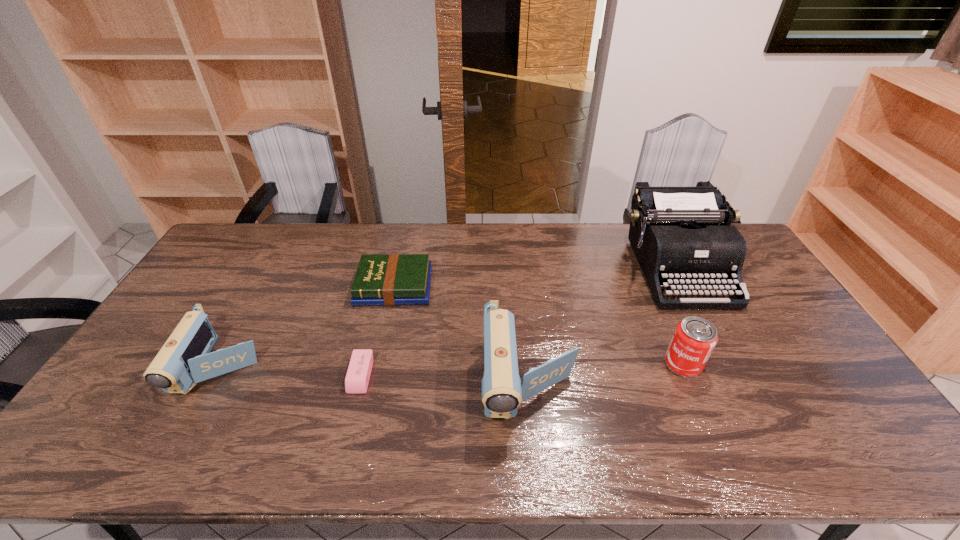
Find the location of `free space located on the front of the fifth tallest object`. free space located on the front of the fifth tallest object is located at coordinates (381, 345).

I want to click on blank space located on the back of the can, so click(650, 288).

The image size is (960, 540). Find the location of `object that is at the far edge`. object that is at the far edge is located at coordinates (674, 232).

Identify the location of eraser present at the near edge. pyautogui.click(x=358, y=374).

The image size is (960, 540). In order to click on object present at the left edge in this screenshot , I will do `click(185, 359)`.

Locate an element on the screen. This screenshot has width=960, height=540. object at the right edge is located at coordinates (674, 232).

You are a GUI agent. You are given a task and a screenshot of the screen. Output one action in this format:
    pyautogui.click(x=<x>, y=<y>)
    Task: Click on the object at the near left corner
    The image size is (960, 540).
    Given the screenshot: What is the action you would take?
    pyautogui.click(x=185, y=359)

You are a GUI agent. You are given a task and a screenshot of the screen. Output one action in this format:
    pyautogui.click(x=<x>, y=<y>)
    Task: Click on the object at the far right corner
    
    Given the screenshot: What is the action you would take?
    [674, 232]

In order to click on vacant space at the far edge in this screenshot , I will do `click(550, 262)`.

You are a GUI agent. You are given a task and a screenshot of the screen. Output one action in this format:
    pyautogui.click(x=<x>, y=<y>)
    Task: Click on the vacant position at the near edge of the desktop
    The width and height of the screenshot is (960, 540).
    Given the screenshot: What is the action you would take?
    pyautogui.click(x=676, y=420)